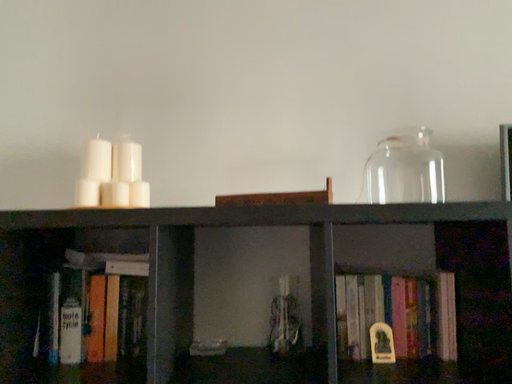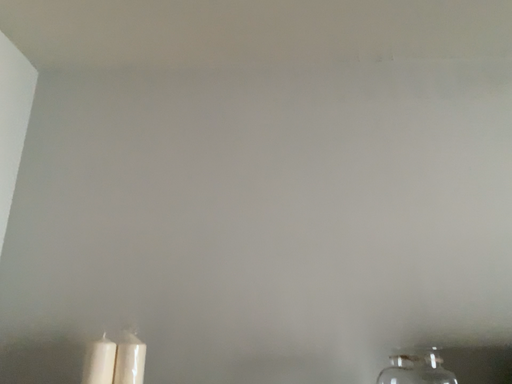
Question: How did the camera likely rotate when shooting the video?

Choices:
 (A) rotated upward
 (B) rotated downward

Answer: (A)